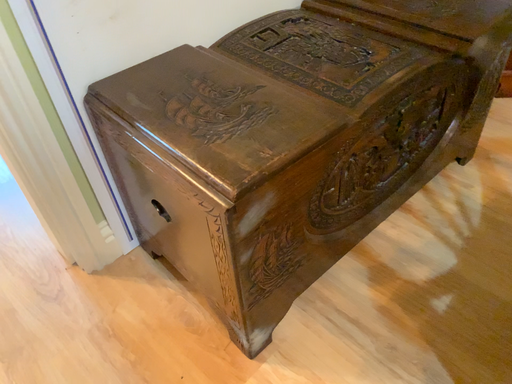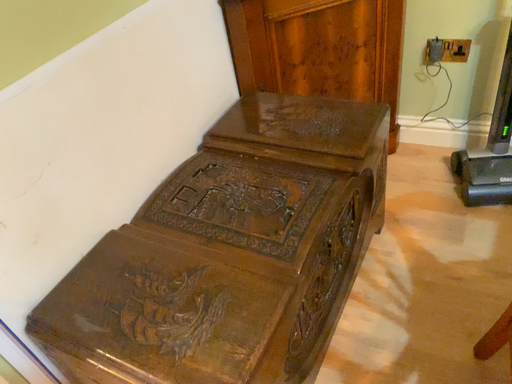
Question: How did the camera likely rotate when shooting the video?

Choices:
 (A) rotated downward
 (B) rotated upward

Answer: (B)